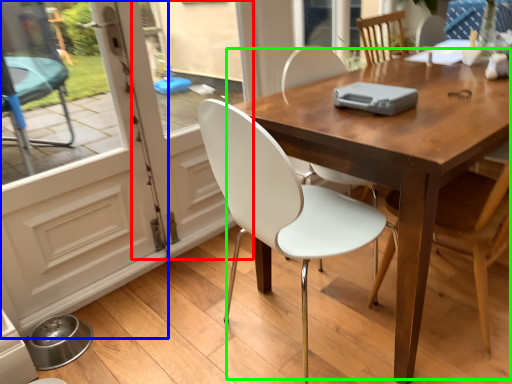
Question: Which is farther away from screen door (highlighted by a red box)? screen door (highlighted by a blue box) or kitchen & dining room table (highlighted by a green box)?

Choices:
 (A) screen door
 (B) kitchen & dining room table

Answer: (B)